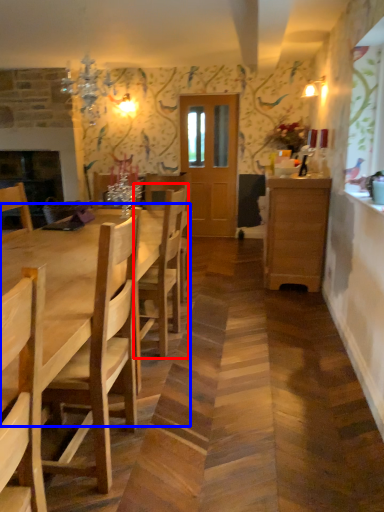
Question: Which point is closer to the camera, chair (highlighted by a red box) or kitchen & dining room table (highlighted by a blue box)?

Choices:
 (A) chair
 (B) kitchen & dining room table

Answer: (B)